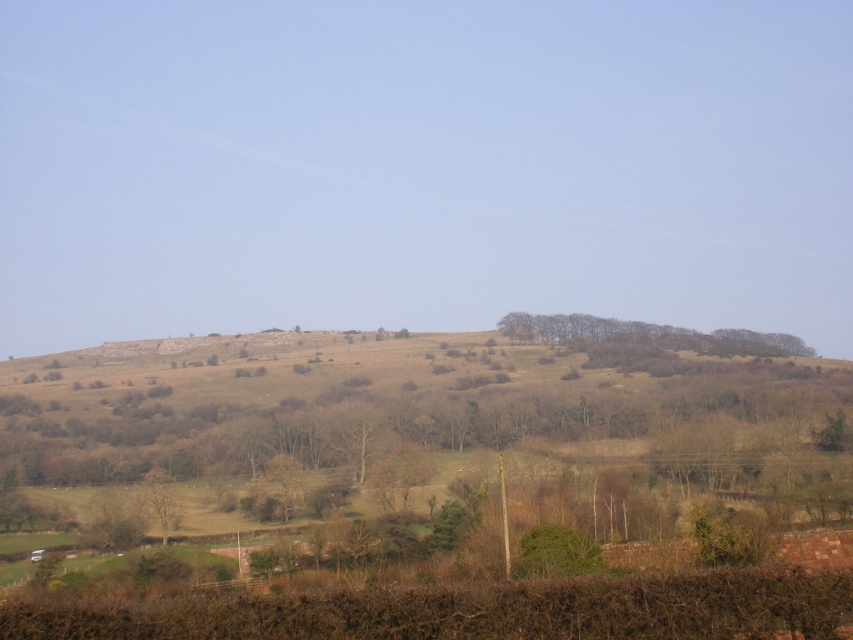
Question: Is the position of brown textured trees at center more distant than that of brown textured tree at lower left?

Choices:
 (A) no
 (B) yes

Answer: (B)

Question: Which object is farther from the camera taking this photo?

Choices:
 (A) brown textured trees at center
 (B) brown textured tree at lower left

Answer: (A)

Question: Can you confirm if brown textured trees at center is positioned to the left of brown textured tree at lower left?

Choices:
 (A) yes
 (B) no

Answer: (B)

Question: Does brown textured trees at center have a smaller size compared to brown textured tree at lower left?

Choices:
 (A) no
 (B) yes

Answer: (A)

Question: Which of the following is the closest to the observer?

Choices:
 (A) (538, 316)
 (B) (166, 474)

Answer: (B)